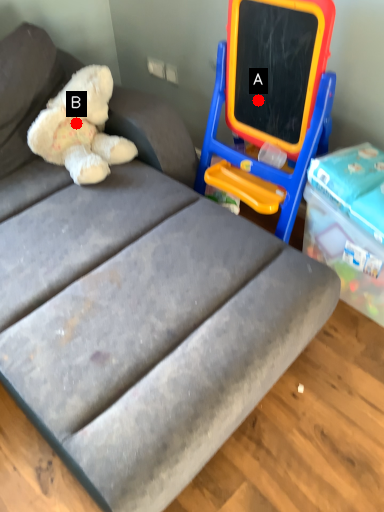
Question: Two points are circled on the image, labeled by A and B beside each circle. Which point is closer to the camera?

Choices:
 (A) A is closer
 (B) B is closer

Answer: (A)